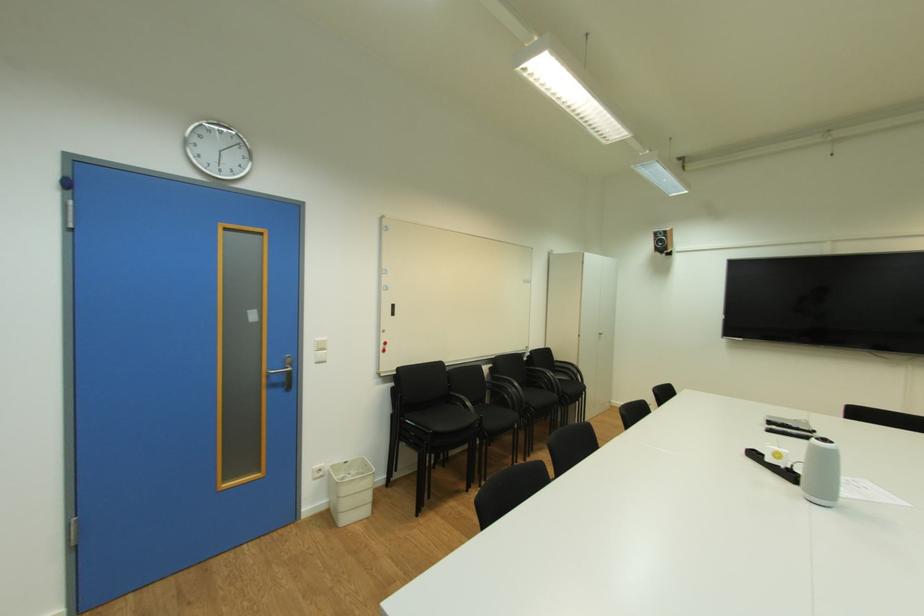
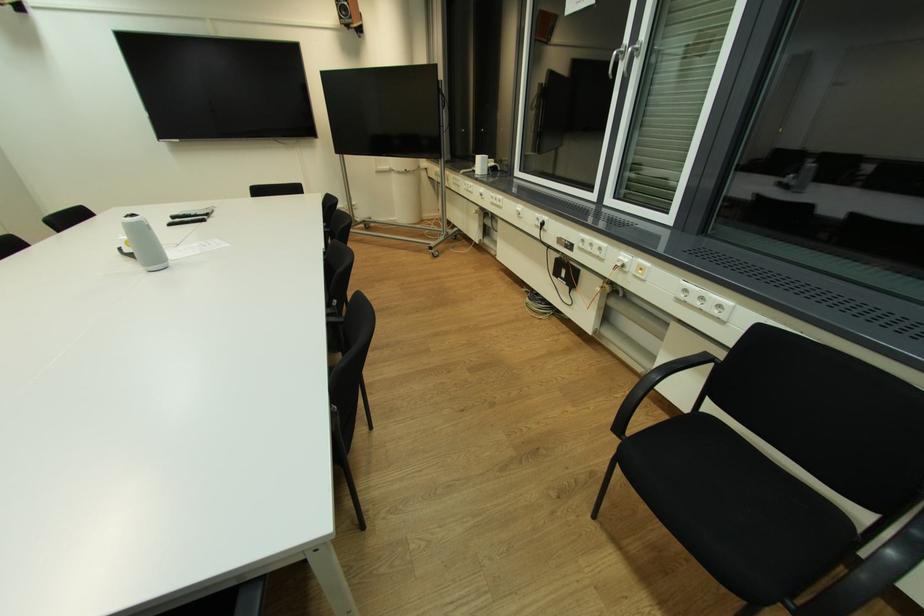
The point at (799,426) is marked in the first image. Where is the corresponding point in the second image?

(198, 214)